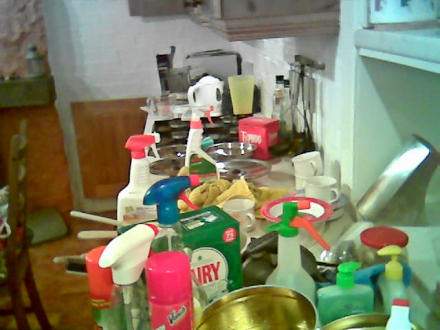
I want to click on glass bottle, so click(x=285, y=102).